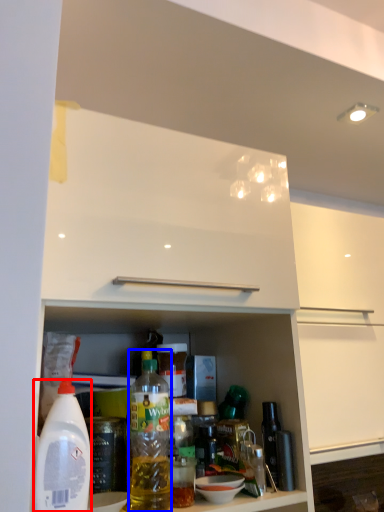
Question: Which object appears closest to the camera in this image, bottle (highlighted by a red box) or bottle (highlighted by a blue box)?

Choices:
 (A) bottle
 (B) bottle

Answer: (A)